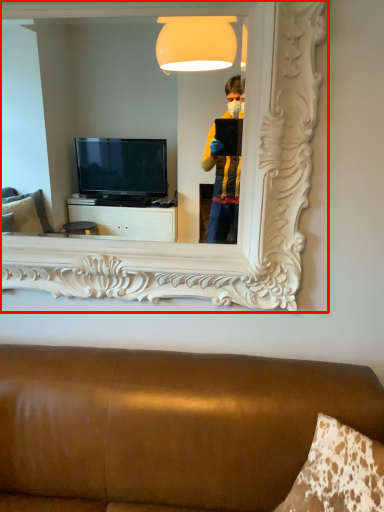
Question: From the image's perspective, considering the relative positions of mirror (annotated by the red box) and furniture in the image provided, where is mirror (annotated by the red box) located with respect to the staircase?

Choices:
 (A) below
 (B) above

Answer: (B)